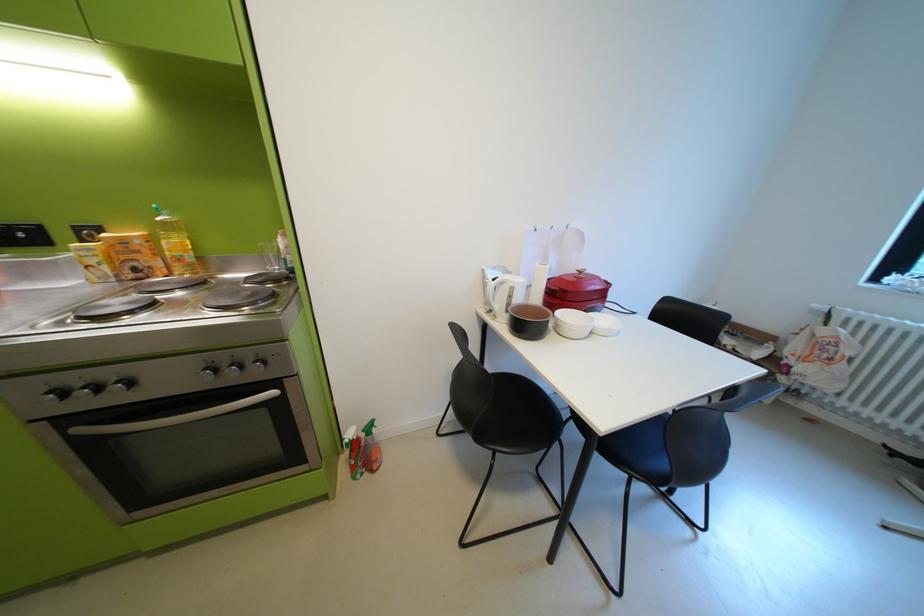
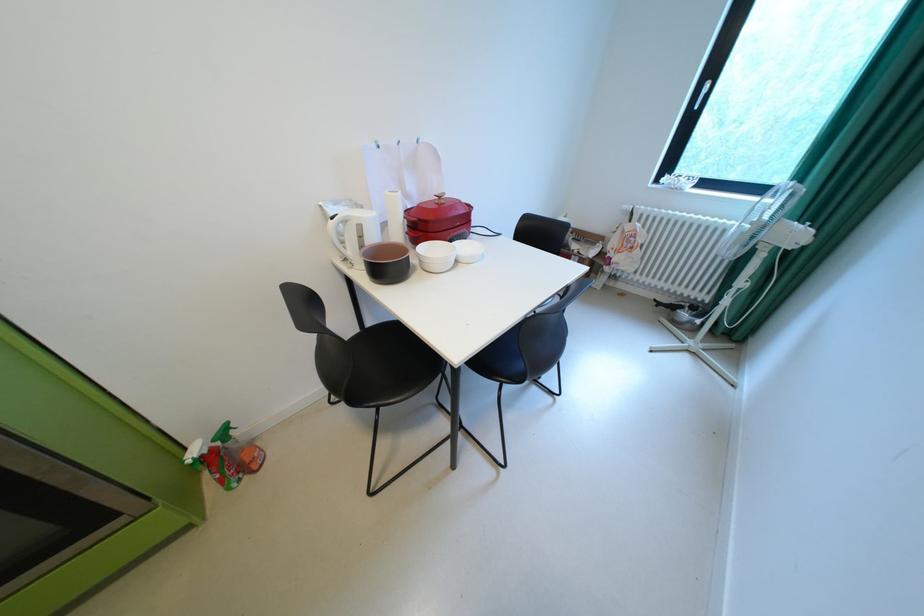
Find the pixel in the second image that matches (x=590, y=273) in the first image.

(450, 198)